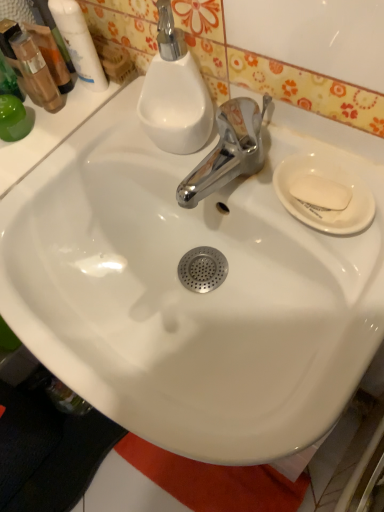
Find the location of `vacant area that is in front of white ceramic plate at right`. vacant area that is in front of white ceramic plate at right is located at coordinates (336, 316).